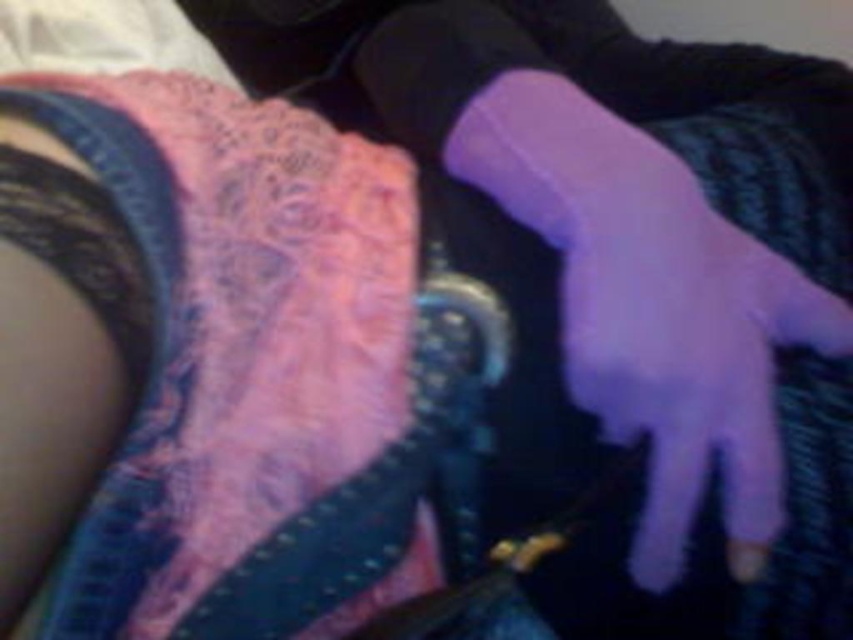
Which is below, purple matte glove at center or purple matte sock at center?

purple matte glove at center is below.

From the picture: Who is taller, purple matte glove at center or purple matte sock at center?

purple matte glove at center

Is point (656, 352) less distant than point (700, 209)?

Yes, point (656, 352) is in front of point (700, 209).

Locate an element on the screen. Image resolution: width=853 pixels, height=640 pixels. purple matte glove at center is located at coordinates (683, 353).